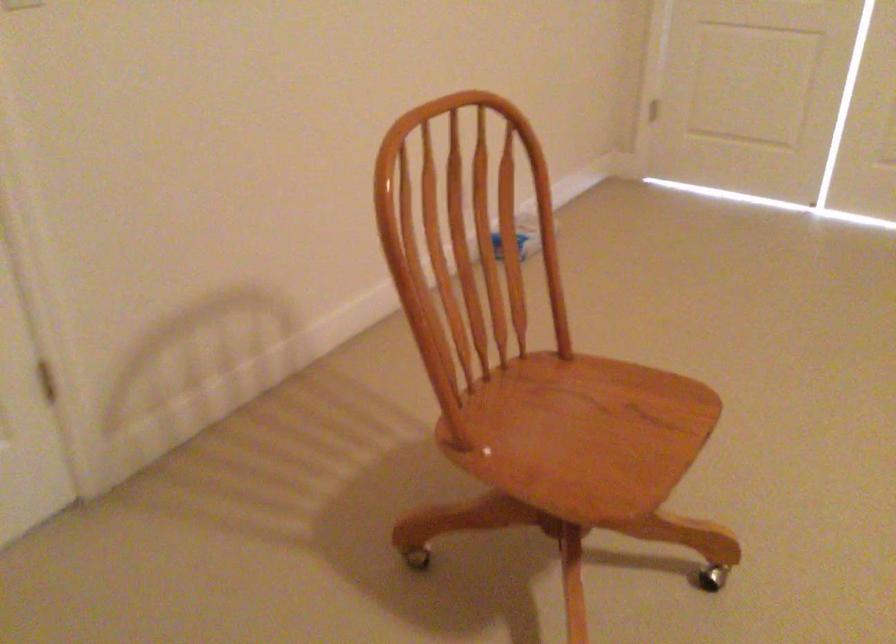
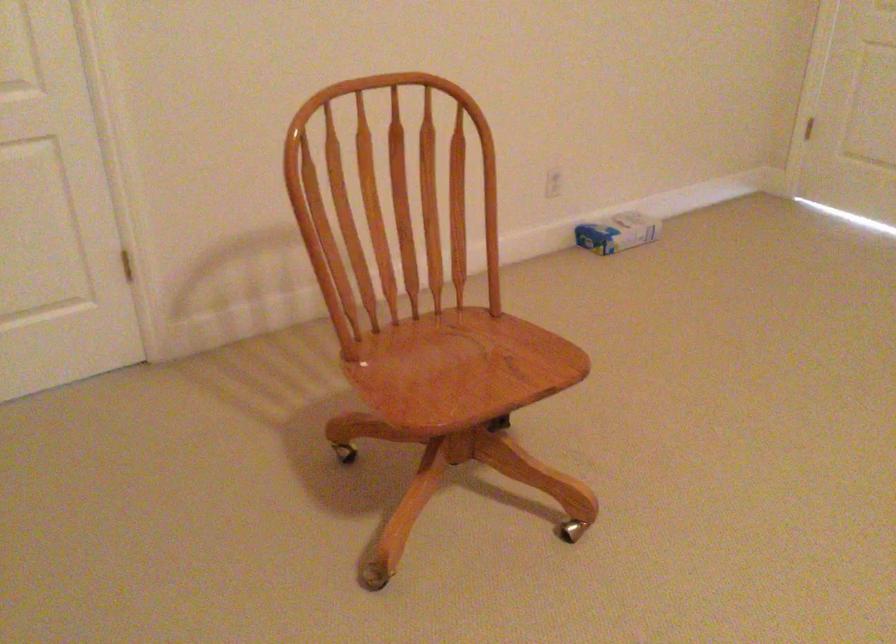
Find the pixel in the second image that matches point 558,444 in the first image.

(428, 374)